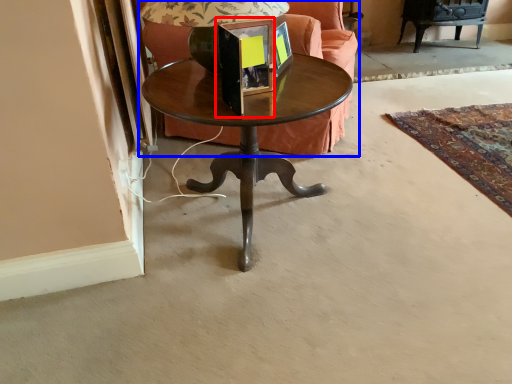
Question: Among these objects, which one is nearest to the camera, picture frame (highlighted by a red box) or studio couch (highlighted by a blue box)?

Choices:
 (A) picture frame
 (B) studio couch

Answer: (A)